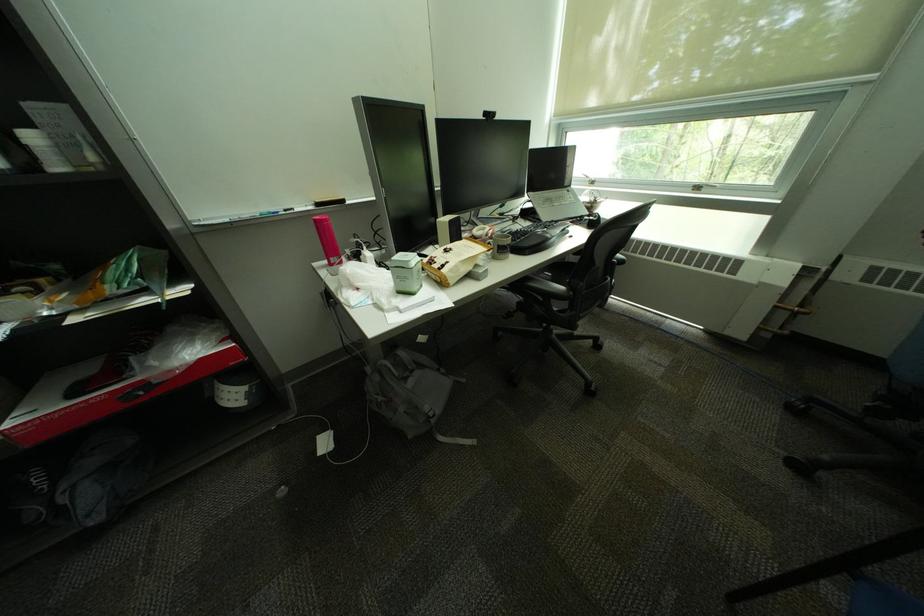
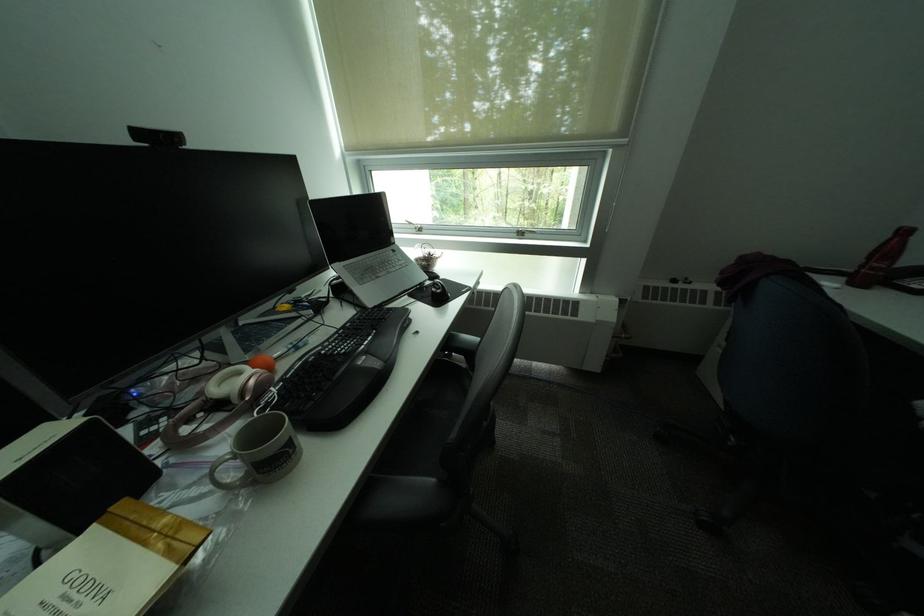
Question: The images are taken continuously from a first-person perspective. In which direction is your viewpoint rotating?

Choices:
 (A) Left
 (B) Right
 (C) Up
 (D) Down

Answer: (B)